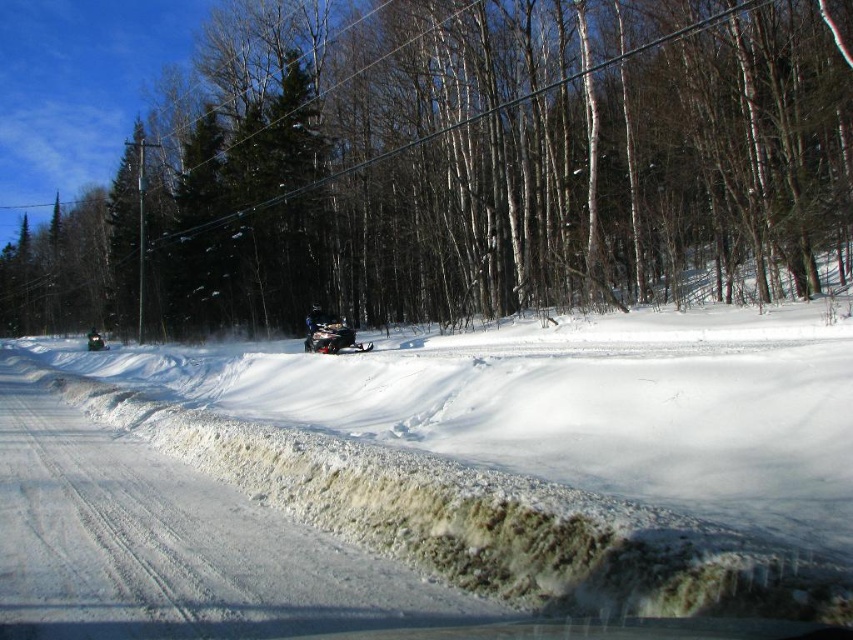
You are planning to take a child on a snowmobile ride. The child is 1.2 meters tall. The shiny silver snowmobile at center and the shiny black snowmobile at center are available. Which snowmobile would be more suitable for the child to ride comfortably?

The shiny black snowmobile at center is shorter than the shiny silver snowmobile at center. Since the child is 1.2 meters tall, the shorter shiny black snowmobile at center would be more suitable for the child to ride comfortably.

You are planning to take a photo of the brown wood tree at center and the shiny black snowmobile at center. Which object would you need to adjust your camera settings to capture more accurately due to its size?

The brown wood tree at center has a larger width than the shiny black snowmobile at center, so you would need to adjust your camera settings to capture the brown wood tree at center more accurately due to its size.

Consider the image. You are standing at the center of the snowy road and want to locate the shiny silver snowmobile at center. According to the coordinates provided, in which direction should you look relative to your position?

The shiny silver snowmobile at center is located at coordinates point (x=331, y=336). Since you are at the center of the snowy road, you should look slightly to the right and forward to find it because the x coordinate 0.525 is to the right of the center point 0.5, and the y coordinate 0.389 is forward from the center point 0.5 in the image coordinate system.